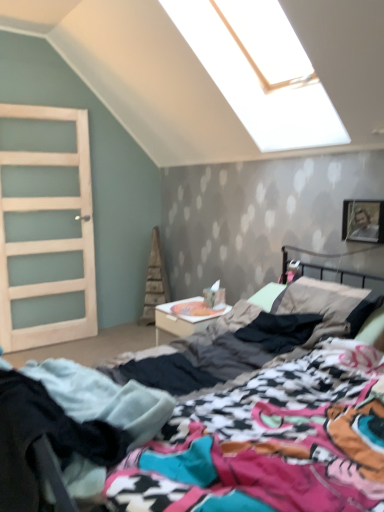
Measure the distance between metallic silver picture frame at upper right and camera.

They are 8.01 feet apart.

The image size is (384, 512). What do you see at coordinates (45, 227) in the screenshot?
I see `clear glass door at left` at bounding box center [45, 227].

Where is `black cotton pants at lower left`? This screenshot has height=512, width=384. black cotton pants at lower left is located at coordinates (71, 425).

Where is `metallic silver picture frame at upper right`? This screenshot has height=512, width=384. metallic silver picture frame at upper right is located at coordinates click(363, 221).

Is multicolored fabric bed at center positioned with its back to white glossy nightstand at center?

No, white glossy nightstand at center is not at the back of multicolored fabric bed at center.

Considering the sizes of multicolored fabric bed at center and white glossy nightstand at center in the image, is multicolored fabric bed at center taller or shorter than white glossy nightstand at center?

Considering their sizes, multicolored fabric bed at center has more height than white glossy nightstand at center.

From the picture: Considering their positions, is multicolored fabric bed at center located in front of or behind white glossy nightstand at center?

Visually, multicolored fabric bed at center is located in front of white glossy nightstand at center.

Image resolution: width=384 pixels, height=512 pixels. What are the coordinates of `bed located in front of the white glossy nightstand at center` in the screenshot? It's located at (257, 424).

Is black cotton pants at lower left to the right of metallic silver picture frame at upper right from the viewer's perspective?

No, black cotton pants at lower left is not to the right of metallic silver picture frame at upper right.

Does black cotton pants at lower left have a lesser height compared to metallic silver picture frame at upper right?

Incorrect, the height of black cotton pants at lower left does not fall short of that of metallic silver picture frame at upper right.

Does point (32, 435) appear closer or farther from the camera than point (380, 207)?

Clearly, point (32, 435) is closer to the camera than point (380, 207).

Does black cotton pants at lower left come behind metallic silver picture frame at upper right?

No, black cotton pants at lower left is closer to the viewer.

Could you tell me if white glossy nightstand at center is turned towards clear glass door at left?

No, white glossy nightstand at center is not aimed at clear glass door at left.

Is the position of white glossy nightstand at center more distant than that of clear glass door at left?

No, white glossy nightstand at center is closer to the camera.

At what (x,y) coordinates should I click in order to perform the action: click on nightstand below the clear glass door at left (from the image's perspective). Please return your answer as a coordinate pair (x, y). Looking at the image, I should click on (185, 318).

Between white glossy nightstand at center and clear glass door at left, which one has larger width?

white glossy nightstand at center.

From the image's perspective, is black cotton pants at lower left above or below white glossy nightstand at center?

black cotton pants at lower left is situated lower than white glossy nightstand at center in the image.

From a real-world perspective, relative to white glossy nightstand at center, is black cotton pants at lower left vertically above or below?

black cotton pants at lower left is above white glossy nightstand at center.

Which object is wider, black cotton pants at lower left or white glossy nightstand at center?

With larger width is white glossy nightstand at center.

At what (x,y) coordinates should I click in order to perform the action: click on clothing on the left of white glossy nightstand at center. Please return your answer as a coordinate pair (x, y). Image resolution: width=384 pixels, height=512 pixels. Looking at the image, I should click on click(x=71, y=425).

Can you confirm if white glossy nightstand at center is wider than multicolored fabric bed at center?

No, white glossy nightstand at center is not wider than multicolored fabric bed at center.

From a real-world perspective, is white glossy nightstand at center positioned above or below multicolored fabric bed at center?

In terms of real-world spatial position, white glossy nightstand at center is below multicolored fabric bed at center.

Consider the image. Is white glossy nightstand at center situated inside multicolored fabric bed at center or outside?

white glossy nightstand at center lies outside multicolored fabric bed at center.

Is white glossy nightstand at center aimed at multicolored fabric bed at center?

No, white glossy nightstand at center does not turn towards multicolored fabric bed at center.

Between multicolored fabric bed at center and metallic silver picture frame at upper right, which one is positioned behind?

Positioned behind is metallic silver picture frame at upper right.

Looking at this image, considering the sizes of objects multicolored fabric bed at center and metallic silver picture frame at upper right in the image provided, who is bigger, multicolored fabric bed at center or metallic silver picture frame at upper right?

Bigger between the two is multicolored fabric bed at center.

Which of these two, multicolored fabric bed at center or metallic silver picture frame at upper right, is thinner?

Thinner between the two is metallic silver picture frame at upper right.

Does metallic silver picture frame at upper right turn towards clear glass door at left?

No, metallic silver picture frame at upper right is not turned towards clear glass door at left.

From their relative heights in the image, would you say metallic silver picture frame at upper right is taller or shorter than clear glass door at left?

metallic silver picture frame at upper right is shorter than clear glass door at left.

In terms of width, does metallic silver picture frame at upper right look wider or thinner when compared to clear glass door at left?

Considering their sizes, metallic silver picture frame at upper right looks slimmer than clear glass door at left.

Which of these two, metallic silver picture frame at upper right or clear glass door at left, is smaller?

With smaller size is metallic silver picture frame at upper right.

Identify the location of nightstand above the multicolored fabric bed at center (from the image's perspective). The height and width of the screenshot is (512, 384). (185, 318).

Where is `clothing below the metallic silver picture frame at upper right (from the image's perspective)`? This screenshot has height=512, width=384. clothing below the metallic silver picture frame at upper right (from the image's perspective) is located at coordinates (71, 425).

Considering their positions, is metallic silver picture frame at upper right positioned closer to white glossy nightstand at center than black cotton pants at lower left?

Among the two, metallic silver picture frame at upper right is located nearer to white glossy nightstand at center.

Considering their positions, is white glossy nightstand at center positioned closer to multicolored fabric bed at center than clear glass door at left?

white glossy nightstand at center lies closer to multicolored fabric bed at center than the other object.

From the image, which object appears to be farther from black cotton pants at lower left, clear glass door at left or multicolored fabric bed at center?

The object further to black cotton pants at lower left is clear glass door at left.

Estimate the real-world distances between objects in this image. Which object is closer to white glossy nightstand at center, black cotton pants at lower left or multicolored fabric bed at center?

multicolored fabric bed at center is closer to white glossy nightstand at center.

Which object lies further to the anchor point metallic silver picture frame at upper right, multicolored fabric bed at center or clear glass door at left?

clear glass door at left is positioned further to the anchor metallic silver picture frame at upper right.

From the image, which object appears to be nearer to black cotton pants at lower left, white glossy nightstand at center or metallic silver picture frame at upper right?

white glossy nightstand at center is closer to black cotton pants at lower left.

Based on their spatial positions, is black cotton pants at lower left or multicolored fabric bed at center closer to metallic silver picture frame at upper right?

multicolored fabric bed at center lies closer to metallic silver picture frame at upper right than the other object.

Based on their spatial positions, is multicolored fabric bed at center or metallic silver picture frame at upper right closer to black cotton pants at lower left?

multicolored fabric bed at center is positioned closer to the anchor black cotton pants at lower left.

Where is `clothing positioned between multicolored fabric bed at center and metallic silver picture frame at upper right from near to far`? clothing positioned between multicolored fabric bed at center and metallic silver picture frame at upper right from near to far is located at coordinates (71, 425).

Find the location of a particular element. The image size is (384, 512). clothing situated between clear glass door at left and metallic silver picture frame at upper right from left to right is located at coordinates pos(71,425).

Locate an element on the screen. The width and height of the screenshot is (384, 512). clothing between multicolored fabric bed at center and clear glass door at left from front to back is located at coordinates (71, 425).

Find the location of `picture frame located between multicolored fabric bed at center and clear glass door at left in the depth direction`. picture frame located between multicolored fabric bed at center and clear glass door at left in the depth direction is located at coordinates (363, 221).